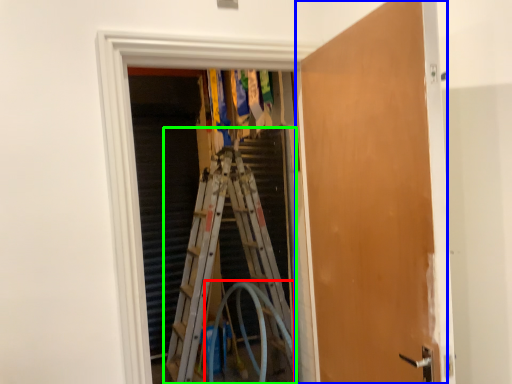
Question: Based on their relative distances, which object is farther from garden hose (highlighted by a red box)? Choose from door (highlighted by a blue box) and ladder (highlighted by a green box).

Choices:
 (A) door
 (B) ladder

Answer: (A)